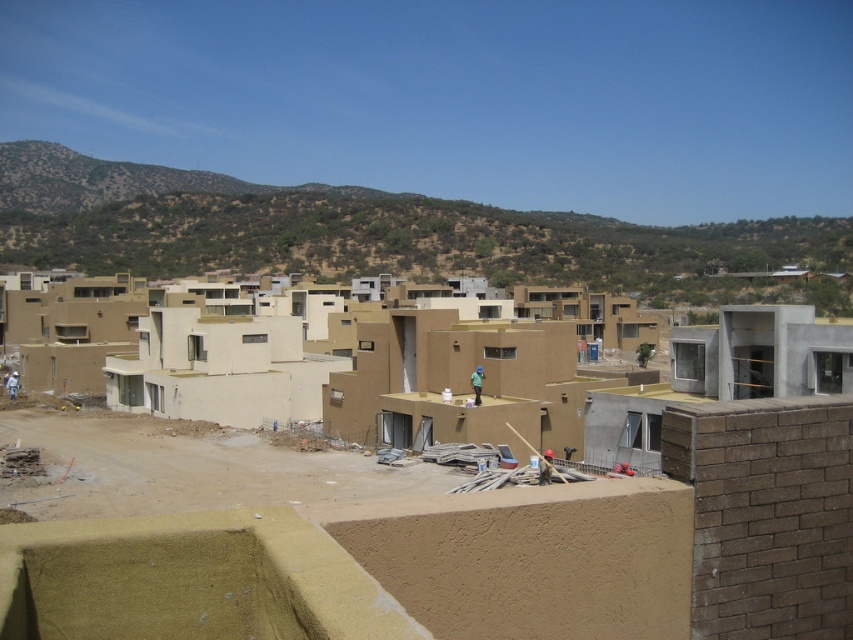
Does brown textured hillside at upper center have a lesser height compared to green matte construction worker at center?

No.

Is brown textured hillside at upper center below green matte construction worker at center?

Incorrect, brown textured hillside at upper center is not positioned below green matte construction worker at center.

Does point (201, 243) lie in front of point (473, 381)?

No, (201, 243) is behind (473, 381).

The width and height of the screenshot is (853, 640). What are the coordinates of `brown textured hillside at upper center` in the screenshot? It's located at 366,230.

This screenshot has width=853, height=640. What do you see at coordinates (494, 552) in the screenshot? I see `matte beige building at center` at bounding box center [494, 552].

Is matte beige building at center behind brown textured hillside at upper center?

That is False.

Does point (514, 545) lie behind point (231, 189)?

No, it is in front of (231, 189).

Find the location of a particular element. This screenshot has height=640, width=853. matte beige building at center is located at coordinates (494, 552).

Is matte beige building at center positioned behind green matte construction worker at center?

No, matte beige building at center is in front of green matte construction worker at center.

Can you confirm if matte beige building at center is positioned below green matte construction worker at center?

No.

Does point (273, 589) come in front of point (480, 376)?

Yes, point (273, 589) is in front of point (480, 376).

Locate an element on the screen. The height and width of the screenshot is (640, 853). matte beige building at center is located at coordinates (494, 552).